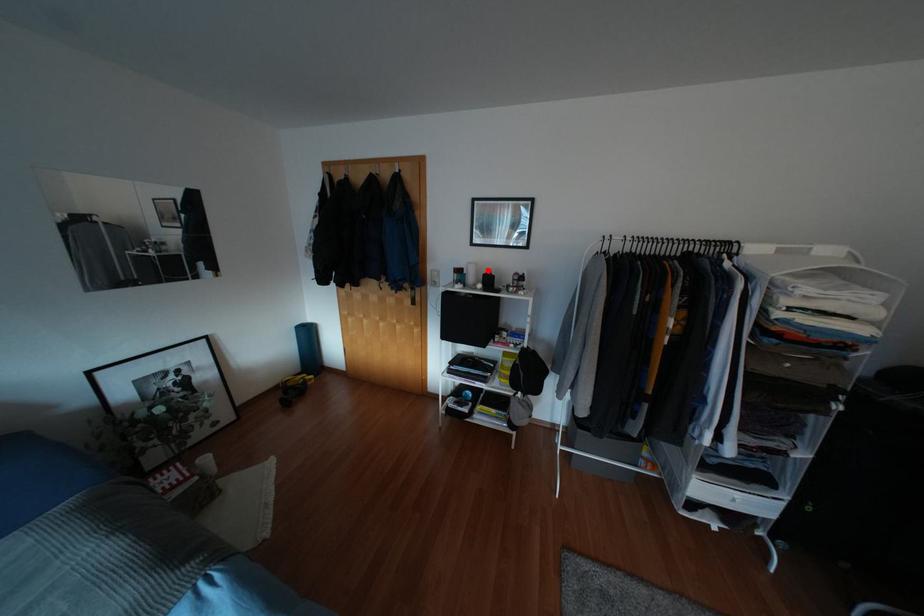
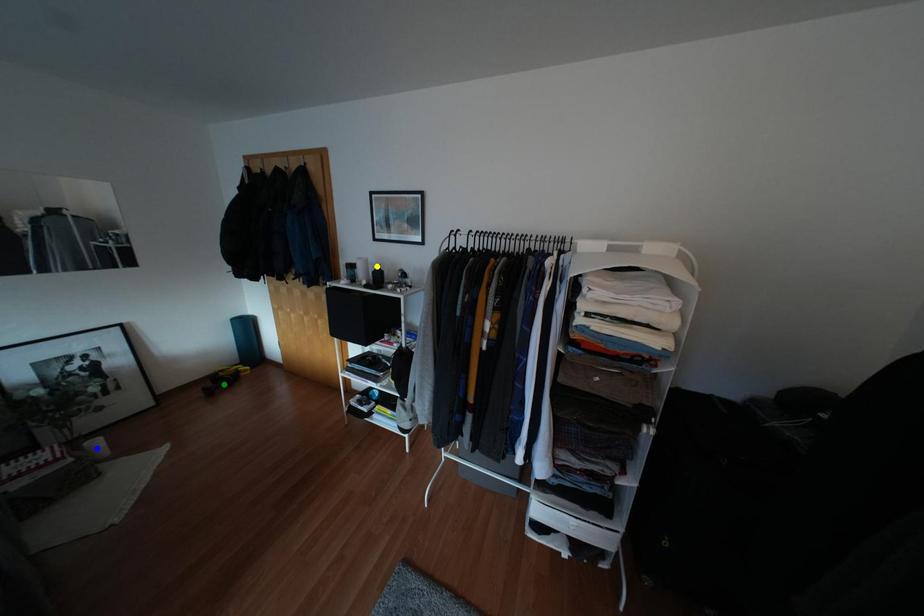
Question: I am providing you with two images of the same scene from different viewpoints. A red point is marked on the first image. You are given multiple points on the second image. Which point in image 2 represents the same 3d spot as the red point in image 1?

Choices:
 (A) blue point
 (B) yellow point
 (C) green point

Answer: (B)